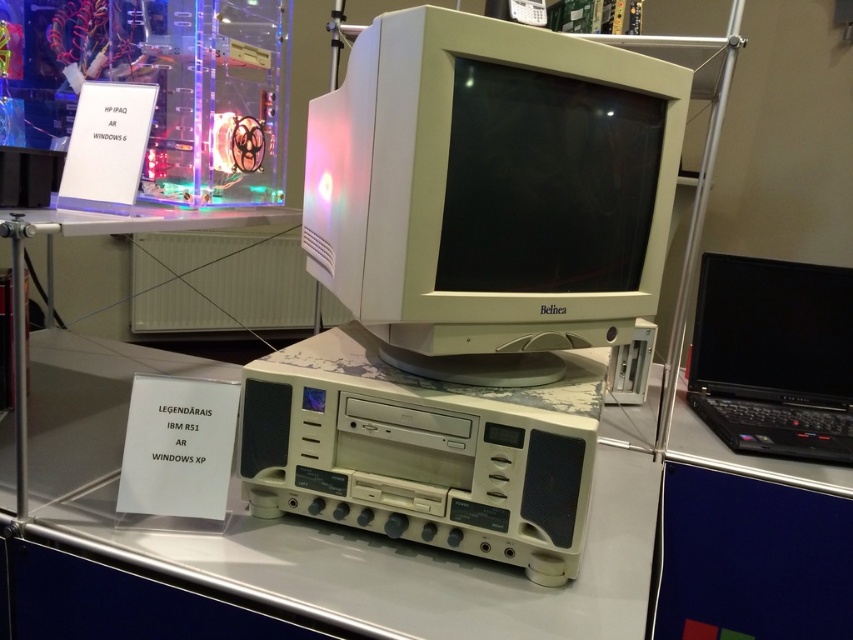
Based on the photo, what is the relationship in size between the white plastic monitor at center and the white plastic table at center in the vintage computer setup?

→ The white plastic monitor at center is smaller than the white plastic table at center.

You are a museum visitor standing in front of the vintage computer setup. You want to take a photo of both the white plastic monitor at center and the black plastic laptop at right. Which object should you focus on first to ensure both are in the frame?

You should focus on the white plastic monitor at center first because it is closer to you than the black plastic laptop at right, so adjusting the camera to capture it ensures the laptop in the background will also be in view.